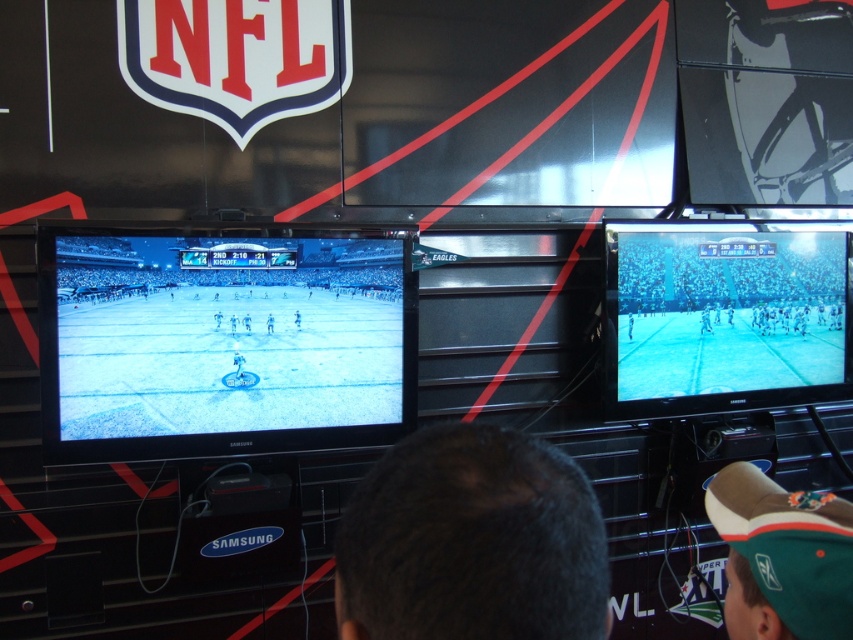
Between green fabric cap at lower right and smooth skin at center, which one has more height?

Standing taller between the two is green fabric cap at lower right.

Can you confirm if green fabric cap at lower right is bigger than smooth skin at center?

Correct, green fabric cap at lower right is larger in size than smooth skin at center.

Describe the element at coordinates (782, 556) in the screenshot. The width and height of the screenshot is (853, 640). I see `green fabric cap at lower right` at that location.

You are a GUI agent. You are given a task and a screenshot of the screen. Output one action in this format:
    pyautogui.click(x=<x>, y=<y>)
    Task: Click on the green fabric cap at lower right
    
    Given the screenshot: What is the action you would take?
    pyautogui.click(x=782, y=556)

Can you confirm if matte black television at right is taller than smooth skin at center?

Yes, matte black television at right is taller than smooth skin at center.

Does point (726, 284) lie in front of point (233, 330)?

No, (726, 284) is further to viewer.

Does point (695, 278) come in front of point (229, 321)?

No.

You are a GUI agent. You are given a task and a screenshot of the screen. Output one action in this format:
    pyautogui.click(x=<x>, y=<y>)
    Task: Click on the matte black television at right
    The height and width of the screenshot is (640, 853).
    Given the screenshot: What is the action you would take?
    pyautogui.click(x=726, y=316)

Does matte black monitor at left appear on the right side of dark hair at center?

In fact, matte black monitor at left is to the left of dark hair at center.

Does matte black monitor at left appear over dark hair at center?

Yes, matte black monitor at left is above dark hair at center.

Measure the distance between matte black monitor at left and camera.

The distance of matte black monitor at left from camera is 6.22 feet.

Find the location of a particular element. matte black monitor at left is located at coordinates (222, 344).